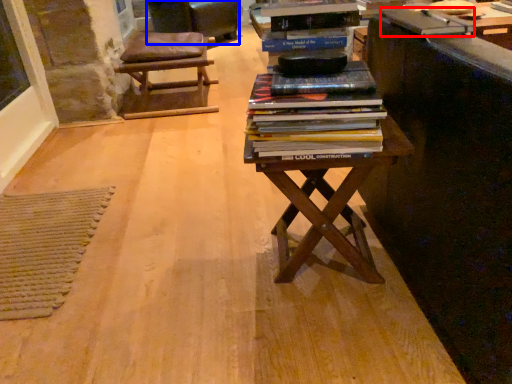
Question: Among these objects, which one is nearest to the camera, paperback book (highlighted by a red box) or rocking chair (highlighted by a blue box)?

Choices:
 (A) paperback book
 (B) rocking chair

Answer: (A)